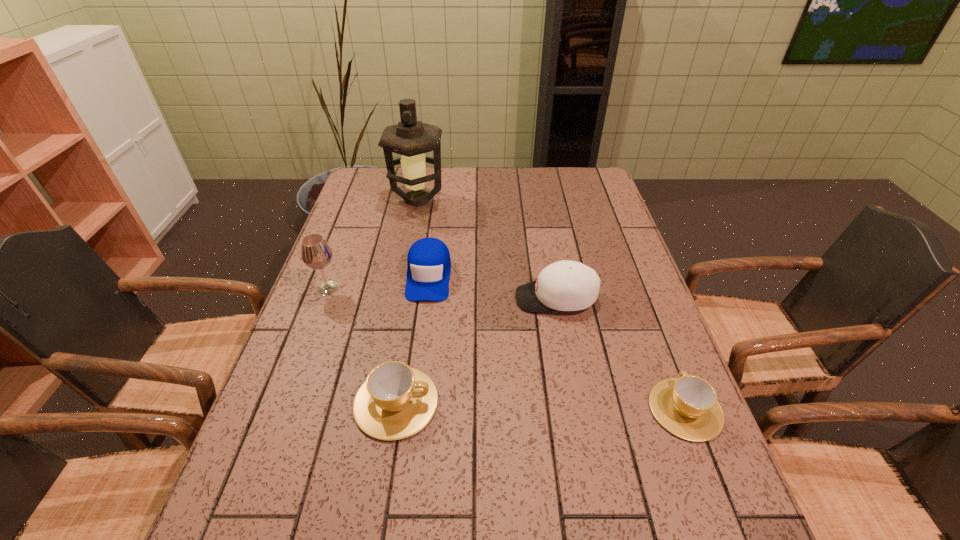
Find the location of `object present at the far edge`. object present at the far edge is located at coordinates (410, 138).

Locate an element on the screen. Image resolution: width=960 pixels, height=540 pixels. oil lamp at the left edge is located at coordinates (410, 138).

Image resolution: width=960 pixels, height=540 pixels. In order to click on wineglass positioned at the left edge in this screenshot , I will do `click(316, 253)`.

You are a GUI agent. You are given a task and a screenshot of the screen. Output one action in this format:
    pyautogui.click(x=<x>, y=<y>)
    Task: Click on the cup at the right edge
    The height and width of the screenshot is (540, 960).
    Given the screenshot: What is the action you would take?
    pyautogui.click(x=687, y=406)

Where is `baseball cap located at the right edge`? This screenshot has width=960, height=540. baseball cap located at the right edge is located at coordinates (565, 285).

Find the location of a particular element. object situated at the far left corner is located at coordinates (410, 138).

Where is `vacant space at the far edge`? vacant space at the far edge is located at coordinates (449, 167).

Locate an element on the screen. vacant area at the near edge is located at coordinates (458, 488).

This screenshot has height=540, width=960. Identify the location of vacant region at the left edge. (361, 281).

This screenshot has width=960, height=540. I want to click on free space at the right edge of the desktop, so click(x=592, y=261).